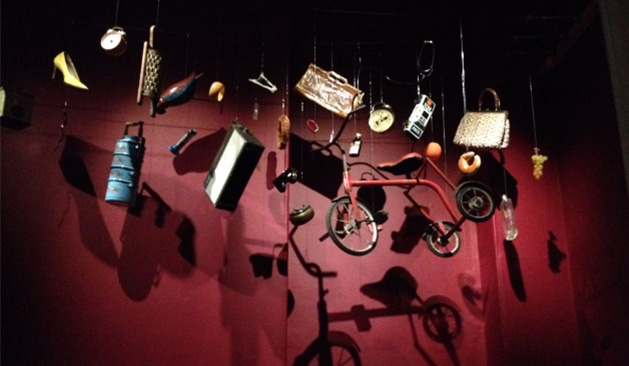
The width and height of the screenshot is (629, 366). What are the coordinates of `box` in the screenshot? It's located at (245, 162).